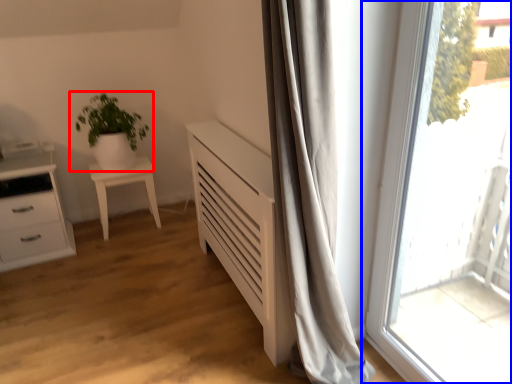
Question: Which point is closer to the camera, houseplant (highlighted by a red box) or window (highlighted by a blue box)?

Choices:
 (A) houseplant
 (B) window

Answer: (B)